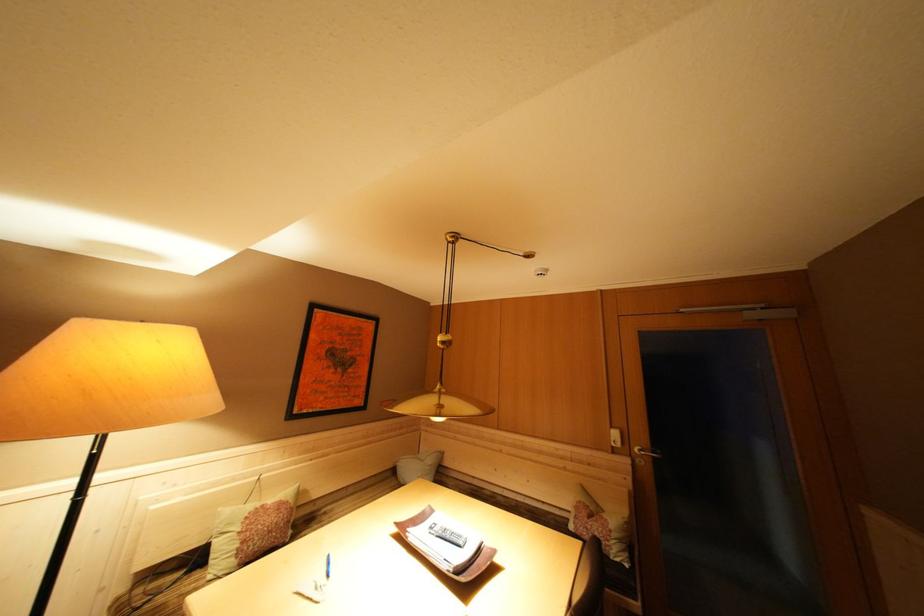
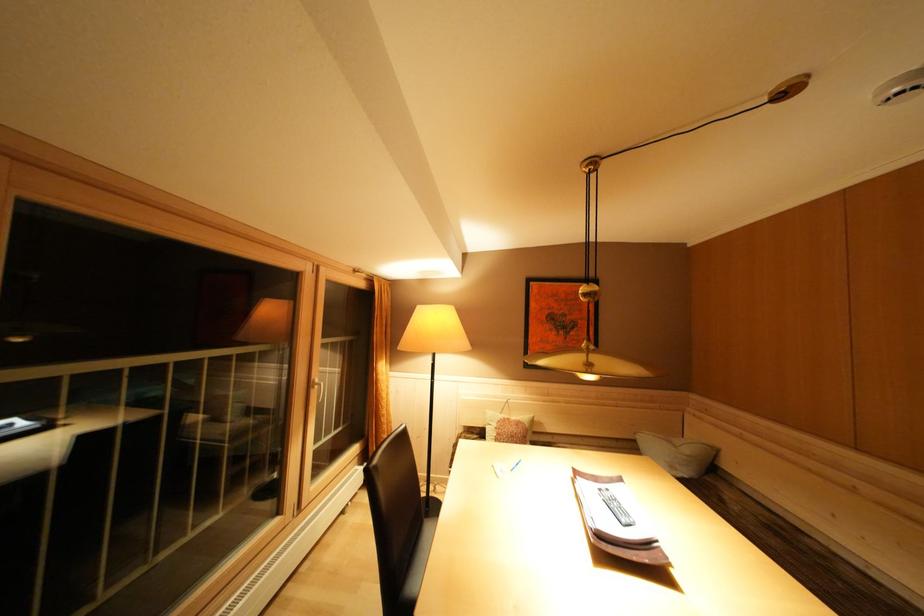
The point at (x=271, y=511) is marked in the first image. Where is the corresponding point in the second image?

(515, 424)